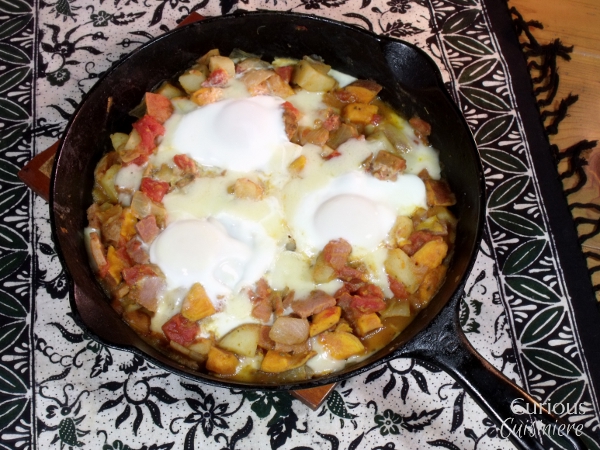
Where is `handle`? This screenshot has width=600, height=450. handle is located at coordinates (492, 386).